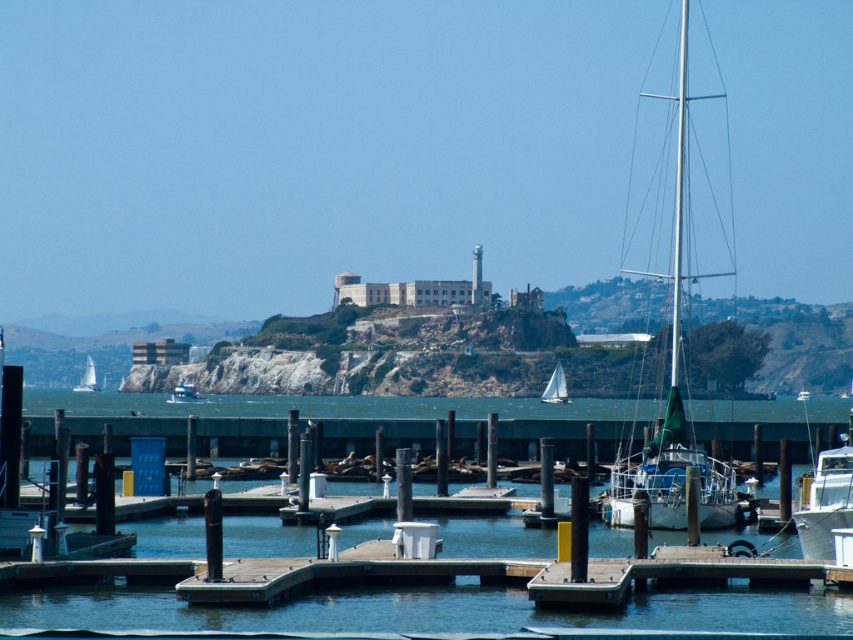
You are standing on the dock and looking at two points in the scene. The first point is at coordinates point (636, 168) and the second is at point (558, 392). Which point is closer to you?

Point (636, 168) is further to the viewer than point (558, 392), so the second point is closer to you.

You are standing at the center of the wooden dock in the foreground of the harbor scene. You notice a white glossy boat at lower right marked by point (825, 502). If you face directly towards the boat, which direction should you turn to see the large light colored building with a cylindrical tower on the island in the background?

If you face directly towards the white glossy boat at lower right marked by point (825, 502), you should turn to your left to see the large light colored building with a cylindrical tower on the island in the background.

You are a photographer standing on the dock and want to capture a photo of the white sailboat at left without the silver metallic mast at right blocking the view. Is it possible to do so by moving to the left side of the dock?

The silver metallic mast at right is positioned over the white sailboat at left, so moving to the left side of the dock might still result in the mast blocking the view of the sailboat.